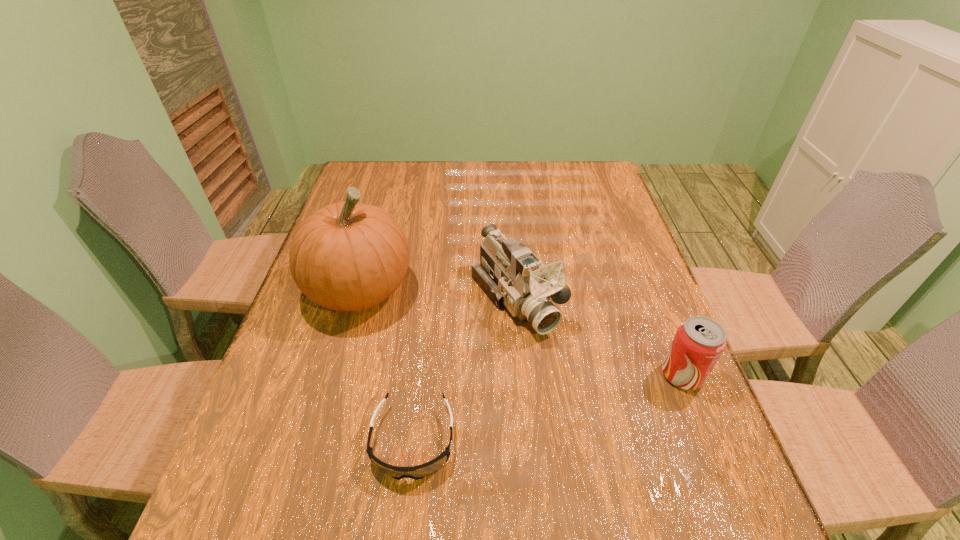
Find the location of a particular element. free space between the tallest object and the shortest object is located at coordinates (386, 365).

The image size is (960, 540). I want to click on vacant area that lies between the second tallest object and the nearest object, so click(465, 370).

The image size is (960, 540). I want to click on object identified as the second closest to the tallest object, so click(x=421, y=471).

Where is `object identified as the second closest to the pumpkin`? object identified as the second closest to the pumpkin is located at coordinates (421, 471).